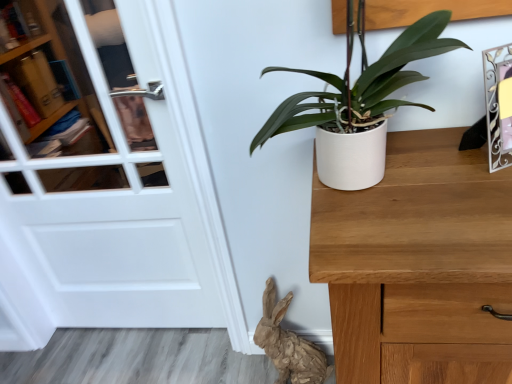
Question: In terms of height, does brown paper rabbit at lower center look taller or shorter compared to white glossy door at left?

Choices:
 (A) tall
 (B) short

Answer: (B)

Question: Considering the relative positions of brown paper rabbit at lower center and white glossy door at left in the image provided, is brown paper rabbit at lower center to the left or to the right of white glossy door at left?

Choices:
 (A) left
 (B) right

Answer: (B)

Question: Based on their relative distances, which object is nearer to the white matte pot at center-right?

Choices:
 (A) metallic silver picture frame at upper right
 (B) brown paper rabbit at lower center
 (C) white glossy door at left

Answer: (A)

Question: Estimate the real-world distances between objects in this image. Which object is farther from the brown paper rabbit at lower center?

Choices:
 (A) white glossy door at left
 (B) metallic silver picture frame at upper right
 (C) white matte pot at center-right

Answer: (B)